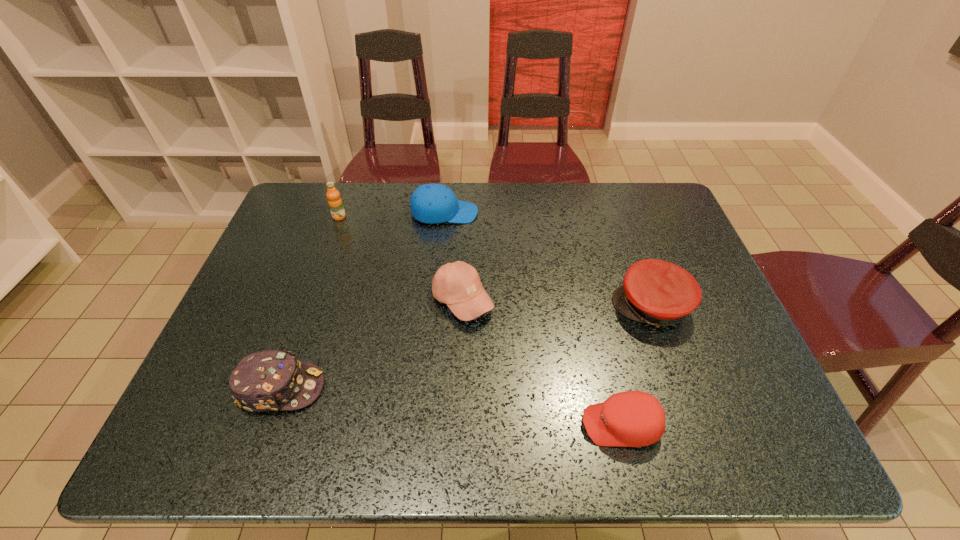
Image resolution: width=960 pixels, height=540 pixels. Find the location of `vacant space in between the second cap from left to right and the baseball cap`. vacant space in between the second cap from left to right and the baseball cap is located at coordinates (453, 256).

The width and height of the screenshot is (960, 540). Identify the location of free area in between the baseball cap and the third nearest cap. (557, 303).

At what (x,y) coordinates should I click in order to perform the action: click on vacant space in between the farthest cap and the leftmost cap. Please return your answer as a coordinate pair (x, y). This screenshot has width=960, height=540. Looking at the image, I should click on (363, 300).

This screenshot has width=960, height=540. Find the location of `empty space between the second cap from left to right and the orange juice`. empty space between the second cap from left to right and the orange juice is located at coordinates (392, 215).

Locate an element on the screen. The height and width of the screenshot is (540, 960). free space between the orange juice and the leftmost cap is located at coordinates (310, 302).

The height and width of the screenshot is (540, 960). Identify the location of object identified as the second closest to the tallest object. (458, 285).

This screenshot has height=540, width=960. In order to click on the third closest object to the tallest object in this screenshot , I will do `click(271, 380)`.

This screenshot has width=960, height=540. In order to click on cap identified as the second closest to the farthest cap in this screenshot , I will do tap(271, 380).

Identify the location of cap that stands as the closest to the farthest cap. (656, 292).

The image size is (960, 540). I want to click on vacant space that satisfies the following two spatial constraints: 1. on the front-facing side of the second cap from left to right; 2. on the label of the orange juice, so click(x=444, y=217).